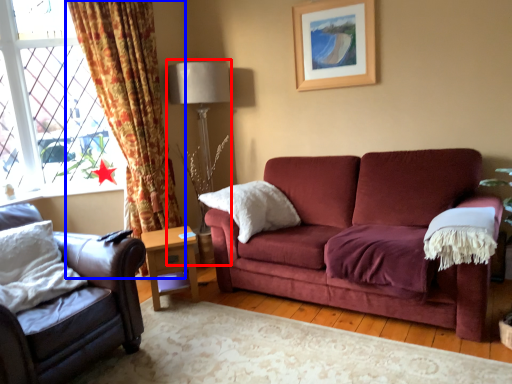
Question: Which object appears farthest to the camera in this image, table lamp (highlighted by a red box) or curtain (highlighted by a blue box)?

Choices:
 (A) table lamp
 (B) curtain

Answer: (A)